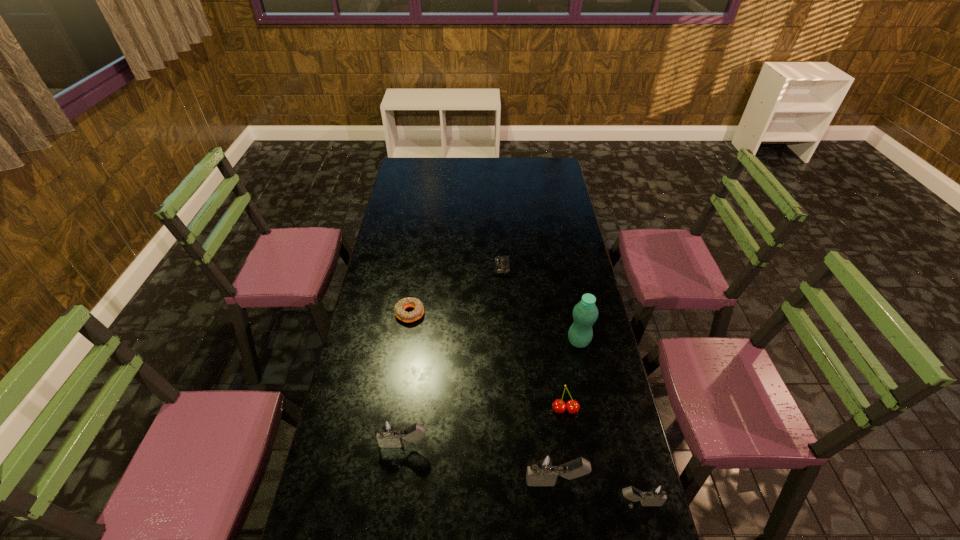
Locate an element on the screen. Image resolution: width=960 pixels, height=540 pixels. the fourth nearest object is located at coordinates (559, 406).

Where is `blank space located 0.080m on the left of the second shortest igniter`? This screenshot has width=960, height=540. blank space located 0.080m on the left of the second shortest igniter is located at coordinates (353, 444).

This screenshot has height=540, width=960. I want to click on free region located on the back of the second igniter from right to left, so click(x=545, y=396).

Identify the location of vacant space located 0.080m on the back of the rightmost igniter. The height and width of the screenshot is (540, 960). [629, 462].

The width and height of the screenshot is (960, 540). What are the coordinates of `free spot located on the display of the farthest object` in the screenshot? It's located at (438, 268).

This screenshot has width=960, height=540. I want to click on free space located on the display of the farthest object, so click(x=433, y=268).

Identify the location of vacant space located on the display of the farthest object. The image size is (960, 540). (482, 268).

Find the location of `free spot located at the front cap of the water bottle`. free spot located at the front cap of the water bottle is located at coordinates (507, 341).

This screenshot has height=540, width=960. What are the coordinates of `vacant space located at the front cap of the water bottle` in the screenshot? It's located at (482, 341).

Identify the location of vacant region located 0.180m at the front cap of the water bottle. (517, 341).